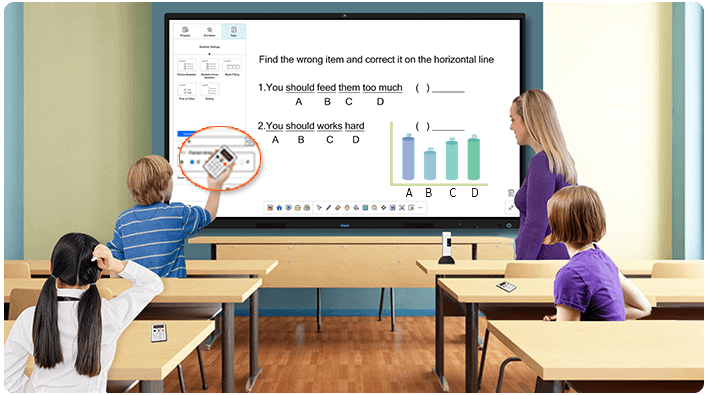
The height and width of the screenshot is (395, 707). Identify the location of white walls. (606, 80).